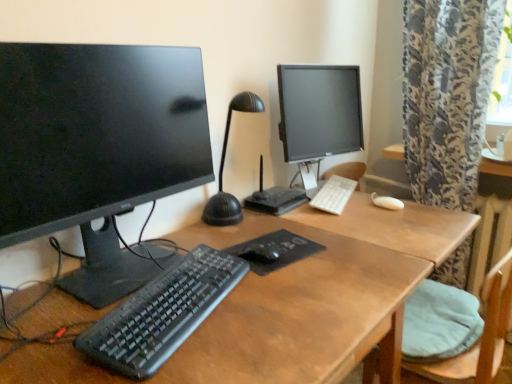
What are the coordinates of `vacant space behind black textured mousepad at center` in the screenshot? It's located at (271, 221).